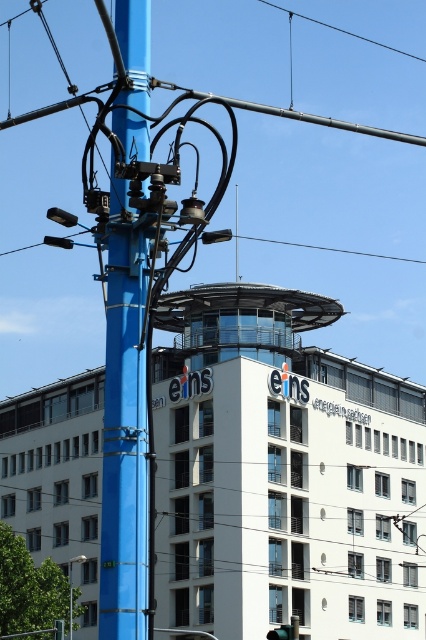
In the scene shown: You are a city planner reviewing the layout of the urban area. You need to determine if the blue painted metal pole at center and the blue metallic pole at lower left are positioned in a way that allows for easy maintenance access. Based on their spatial relationship, what should you consider?

The blue painted metal pole at center is located above the blue metallic pole at lower left, so maintenance access may be challenging due to their vertical positioning.

You are standing at the center of the image. Which direction should you move to get closer to the blue metallic pole at lower left?

You should move to the lower left direction to get closer to the blue metallic pole at lower left since it is located at point (x=71, y=588) which is lower left in the image coordinate system.

You are a city planner reviewing this urban scene. You need to determine the spatial relationship between the blue painted metal pole at center and the blue metallic pole at lower left. Which pole is positioned to the right of the other?

The blue painted metal pole at center is to the right of the blue metallic pole at lower left.